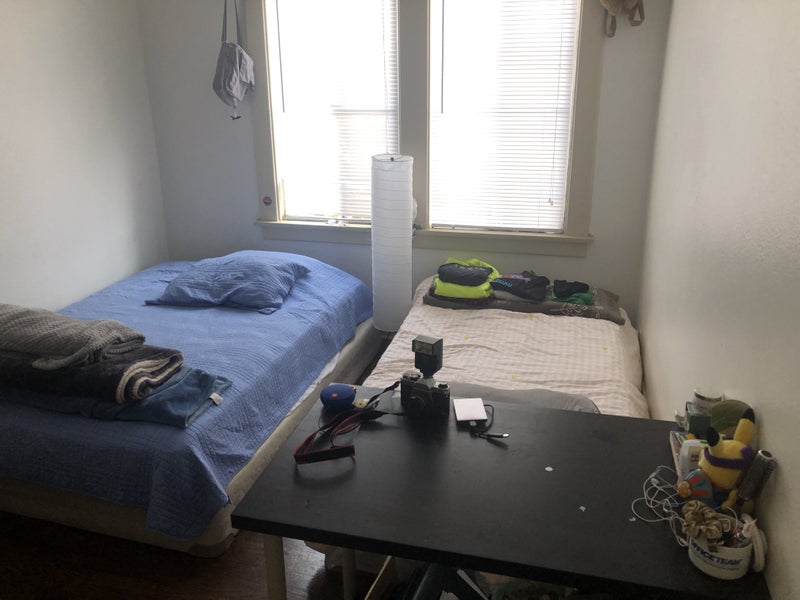
Find the location of a particular element. stacked clothing is located at coordinates (468, 267), (522, 285), (557, 298).